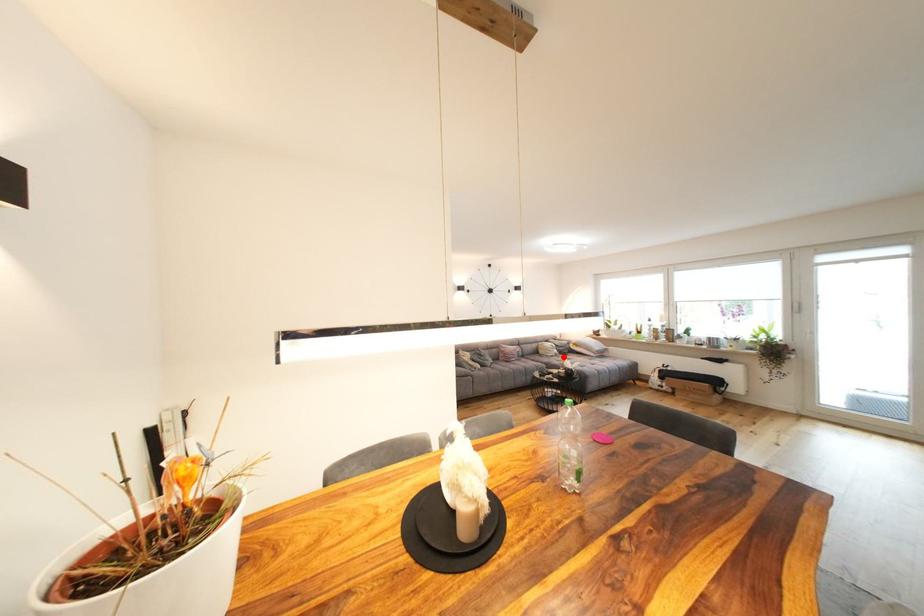
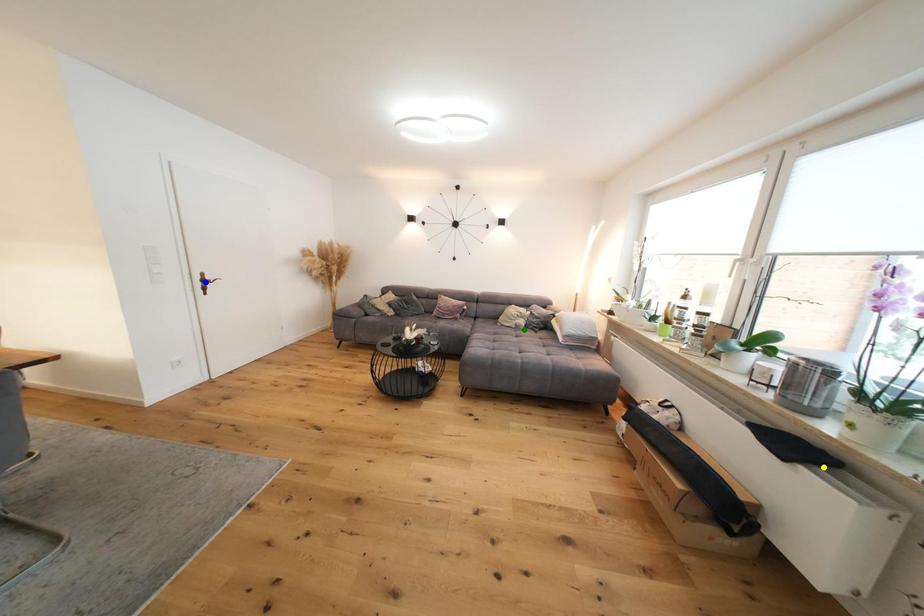
Question: I am providing you with two images of the same scene from different viewpoints. A red point is marked on the first image. You are given multiple points on the second image. Which spot in image 2 lines up with the point in image 1?

Choices:
 (A) yellow point
 (B) blue point
 (C) green point

Answer: (C)